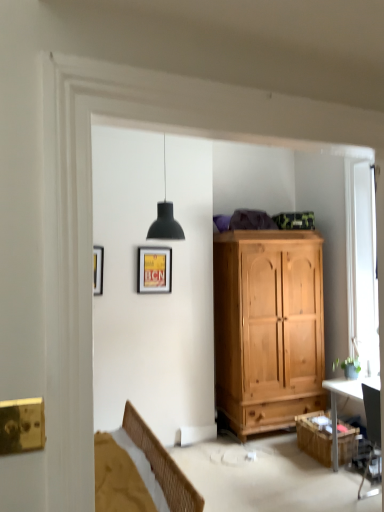
Question: Is white wooden window at right thinner than wooden cabinet at lower right?

Choices:
 (A) no
 (B) yes

Answer: (B)

Question: Does white wooden window at right have a larger size compared to wooden cabinet at lower right?

Choices:
 (A) no
 (B) yes

Answer: (B)

Question: Is white wooden window at right positioned behind wooden cabinet at lower right?

Choices:
 (A) no
 (B) yes

Answer: (B)

Question: Is white wooden window at right closer to the viewer compared to wooden cabinet at lower right?

Choices:
 (A) yes
 (B) no

Answer: (B)

Question: From a real-world perspective, is white wooden window at right positioned over wooden cabinet at lower right based on gravity?

Choices:
 (A) yes
 (B) no

Answer: (A)

Question: From the image's perspective, relative to matte yellow poster at upper center, is wooden cabinet at lower right above or below?

Choices:
 (A) below
 (B) above

Answer: (A)

Question: Is wooden cabinet at lower right situated inside matte yellow poster at upper center or outside?

Choices:
 (A) inside
 (B) outside

Answer: (B)

Question: From their relative heights in the image, would you say wooden cabinet at lower right is taller or shorter than matte yellow poster at upper center?

Choices:
 (A) tall
 (B) short

Answer: (B)

Question: Considering the positions of wooden cabinet at lower right and matte yellow poster at upper center in the image, is wooden cabinet at lower right bigger or smaller than matte yellow poster at upper center?

Choices:
 (A) big
 (B) small

Answer: (A)

Question: From the image's perspective, relative to white wooden window at right, is matte yellow poster at upper center above or below?

Choices:
 (A) below
 (B) above

Answer: (A)

Question: Is matte yellow poster at upper center bigger or smaller than white wooden window at right?

Choices:
 (A) small
 (B) big

Answer: (A)

Question: Is point (167, 276) positioned closer to the camera than point (370, 312)?

Choices:
 (A) farther
 (B) closer

Answer: (A)

Question: In terms of width, does matte yellow poster at upper center look wider or thinner when compared to white wooden window at right?

Choices:
 (A) thin
 (B) wide

Answer: (B)

Question: From a real-world perspective, is wooden cabinet at lower right above or below black glossy desk at right?

Choices:
 (A) below
 (B) above

Answer: (A)

Question: Does point (344, 438) appear closer or farther from the camera than point (342, 382)?

Choices:
 (A) farther
 (B) closer

Answer: (B)